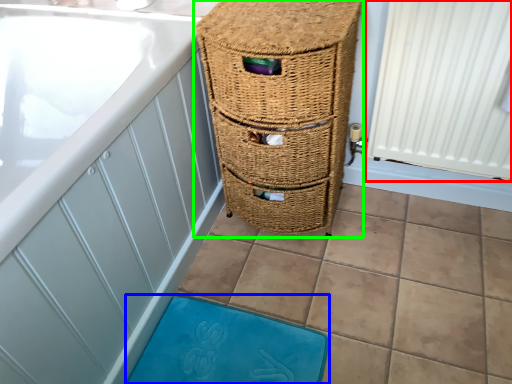
Question: Which is farther away from radiator (highlighted by a red box)? bath mat (highlighted by a blue box) or furniture (highlighted by a green box)?

Choices:
 (A) bath mat
 (B) furniture

Answer: (A)